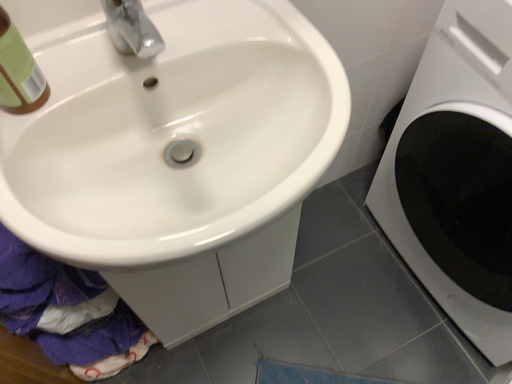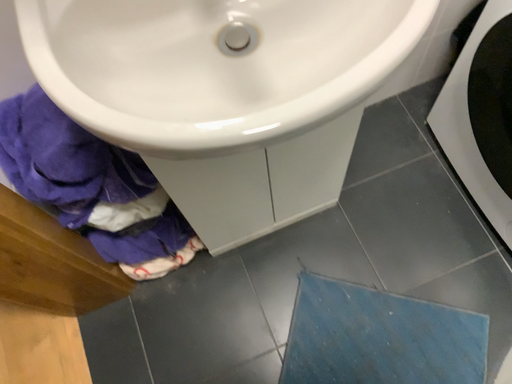
Question: How did the camera likely rotate when shooting the video?

Choices:
 (A) rotated upward
 (B) rotated downward

Answer: (B)